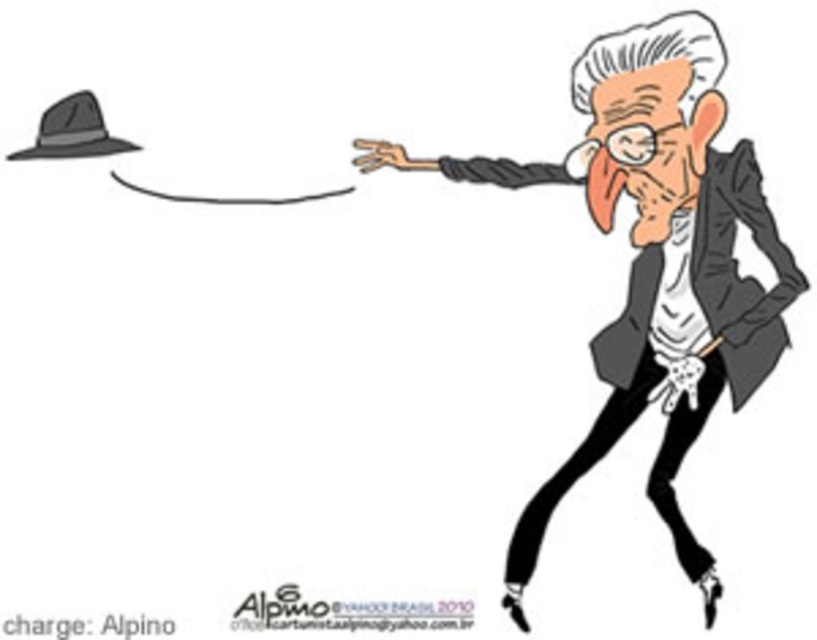
Question: Based on their relative distances, which object is farther from the gray matte hat at upper left?

Choices:
 (A) matte black business suit at right
 (B) dark gray felt hat at upper left

Answer: (B)

Question: Which of these objects is positioned farthest from the dark gray felt hat at upper left?

Choices:
 (A) matte black business suit at right
 (B) gray matte hat at upper left

Answer: (A)

Question: Is gray matte hat at upper left smaller than dark gray felt hat at upper left?

Choices:
 (A) yes
 (B) no

Answer: (B)

Question: Can you confirm if matte black business suit at right is positioned above dark gray felt hat at upper left?

Choices:
 (A) no
 (B) yes

Answer: (A)

Question: Is matte black business suit at right in front of dark gray felt hat at upper left?

Choices:
 (A) yes
 (B) no

Answer: (A)

Question: Based on their relative distances, which object is nearer to the gray matte hat at upper left?

Choices:
 (A) matte black business suit at right
 (B) dark gray felt hat at upper left

Answer: (A)